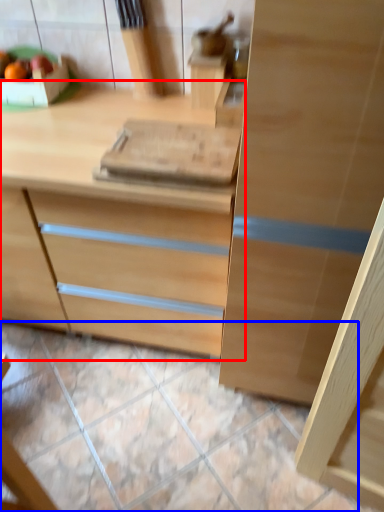
Question: Which object is further to the camera taking this photo, chest of drawers (highlighted by a red box) or tile (highlighted by a blue box)?

Choices:
 (A) chest of drawers
 (B) tile

Answer: (B)